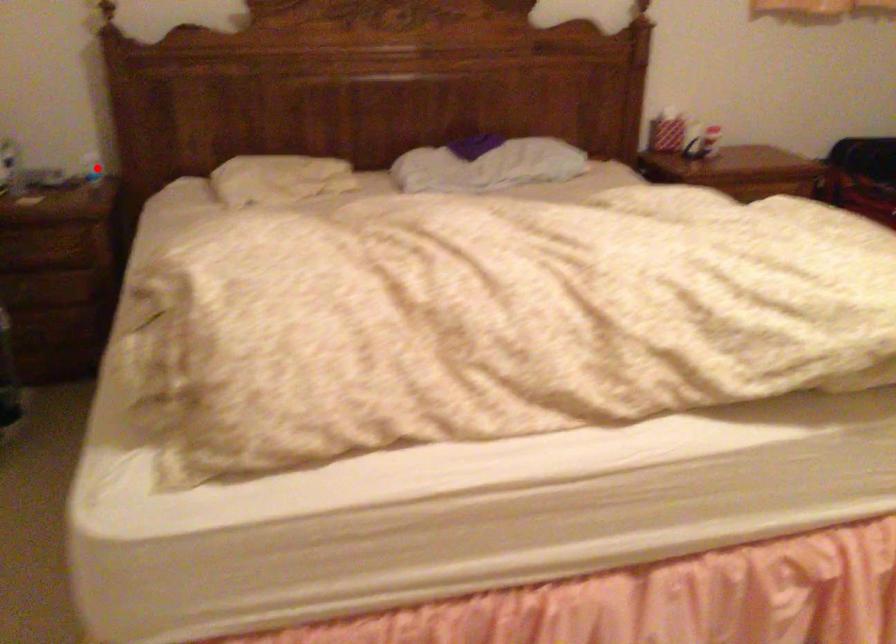
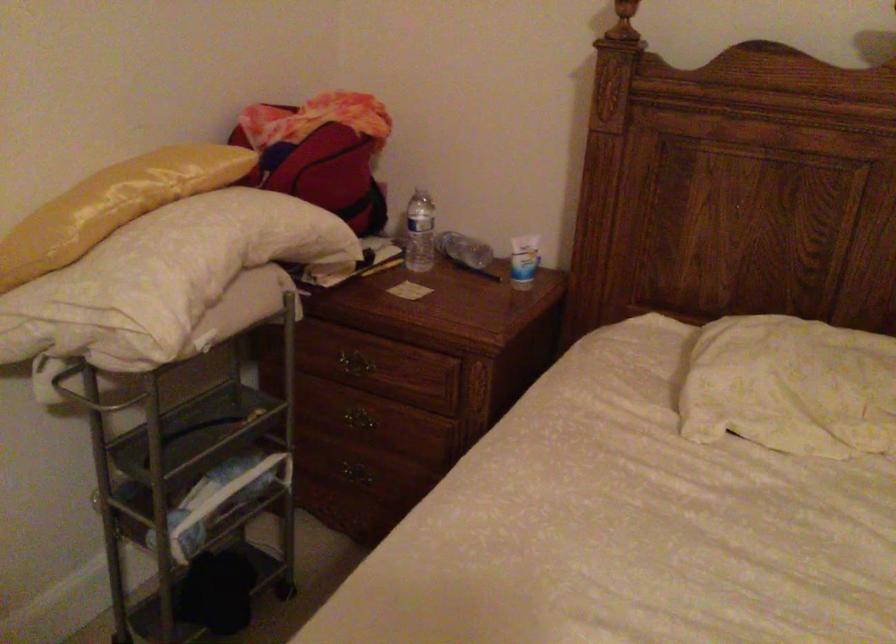
Question: I am providing you with two images of the same scene from different viewpoints. In image1, a red point is highlighted. Considering the same 3D point in image2, which of the following is correct?

Choices:
 (A) It is closer
 (B) It is farther

Answer: (A)